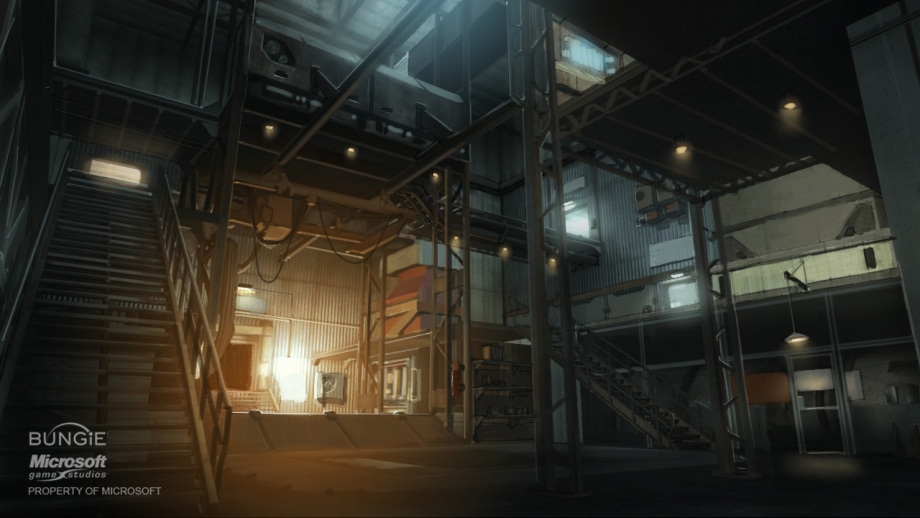
Where is `stair rail`? stair rail is located at coordinates (180, 254), (621, 365).